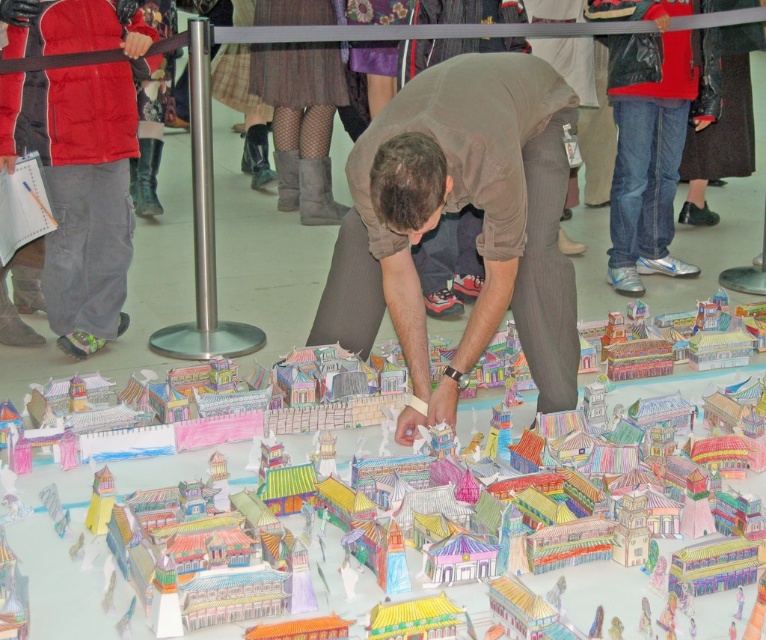
Consider the image. Is brown fabric squat at center shorter than colorful paper model at center?

No, brown fabric squat at center is not shorter than colorful paper model at center.

Is point (514, 122) behind point (331, 568)?

Yes, it is.

Is point (493, 220) less distant than point (113, 468)?

Yes.

This screenshot has height=640, width=766. Find the location of `brown fabric squat at center`. brown fabric squat at center is located at coordinates (457, 209).

Between red jacket at left and colorful paper model at center, which one is positioned higher?

Positioned higher is red jacket at left.

The image size is (766, 640). I want to click on red jacket at left, so click(x=77, y=154).

This screenshot has width=766, height=640. What do you see at coordinates (457, 209) in the screenshot?
I see `brown fabric squat at center` at bounding box center [457, 209].

The image size is (766, 640). Find the location of `brown fabric squat at center`. brown fabric squat at center is located at coordinates (457, 209).